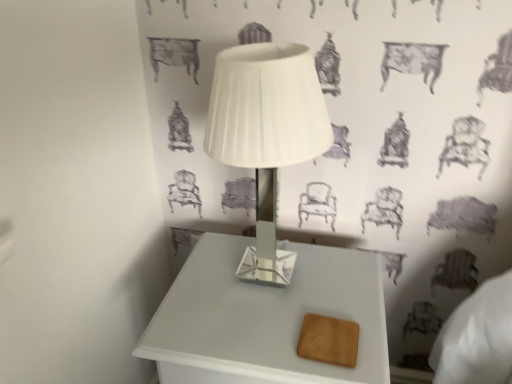
The image size is (512, 384). In order to click on free spot below white glossy lamp at center (from a real-world perspective) in this screenshot , I will do `click(268, 281)`.